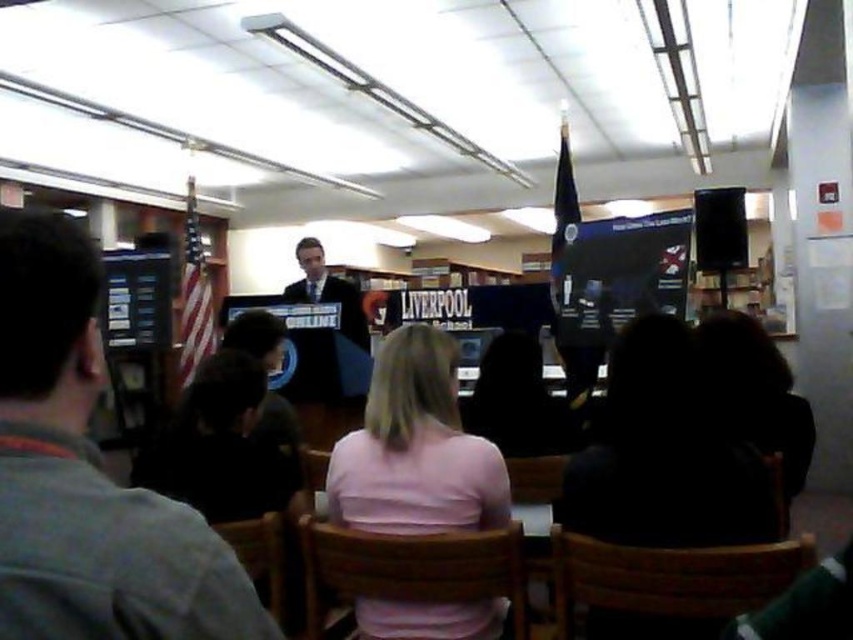
Between wooden chair at lower center and dark suit at center, which one is positioned lower?

wooden chair at lower center is below.

In order to click on wooden chair at lower center in this screenshot , I will do tap(259, 556).

At what (x,y) coordinates should I click in order to perform the action: click on wooden chair at lower center. Please return your answer as a coordinate pair (x, y). This screenshot has width=853, height=640. Looking at the image, I should click on (259, 556).

Who is taller, wooden chair at lower right or dark suit at center?

dark suit at center is taller.

Is point (776, 566) closer to viewer compared to point (349, 339)?

Yes, point (776, 566) is in front of point (349, 339).

In order to click on wooden chair at lower right in this screenshot , I will do `click(670, 577)`.

Is point (68, 397) less distant than point (433, 428)?

Yes, point (68, 397) is closer to viewer.

Is dark gray shirt at left below pink fabric shirt at center?

No.

Who is more forward, (x=155, y=637) or (x=387, y=508)?

Point (x=155, y=637) is more forward.

The height and width of the screenshot is (640, 853). In order to click on dark gray shirt at left in this screenshot , I will do `click(88, 476)`.